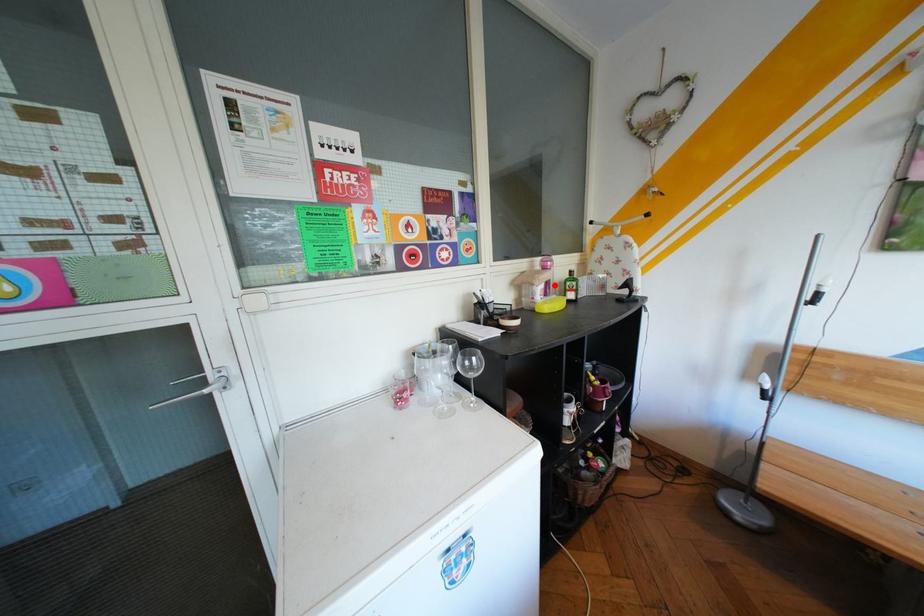
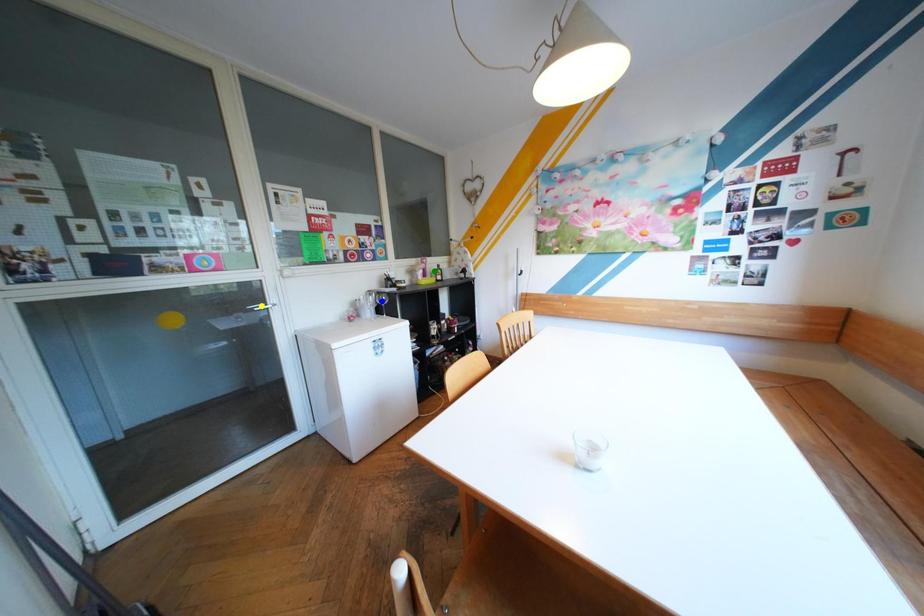
Question: I am providing you with two images of the same scene from different viewpoints. A red point is marked on the first image. You are given multiple points on the second image. Which mark in image 2 goes with the point in image 1?

Choices:
 (A) blue point
 (B) green point
 (C) yellow point

Answer: (B)